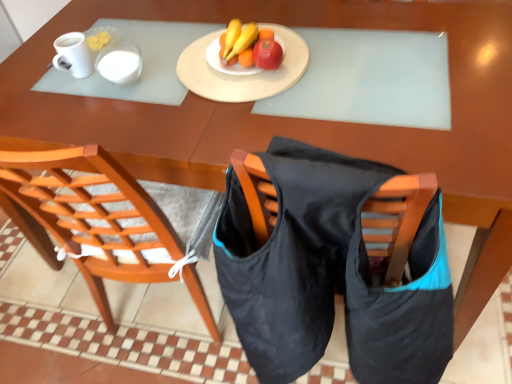
Locate an element on the screen. free space in front of matte white plate at center is located at coordinates (265, 124).